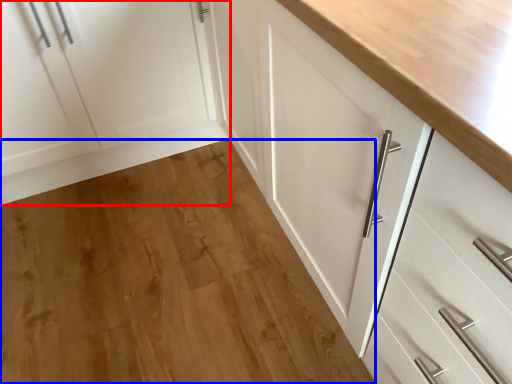
Question: Which of the following is the farthest to the observer, cabinetry (highlighted by a red box) or hardwood (highlighted by a blue box)?

Choices:
 (A) cabinetry
 (B) hardwood

Answer: (A)